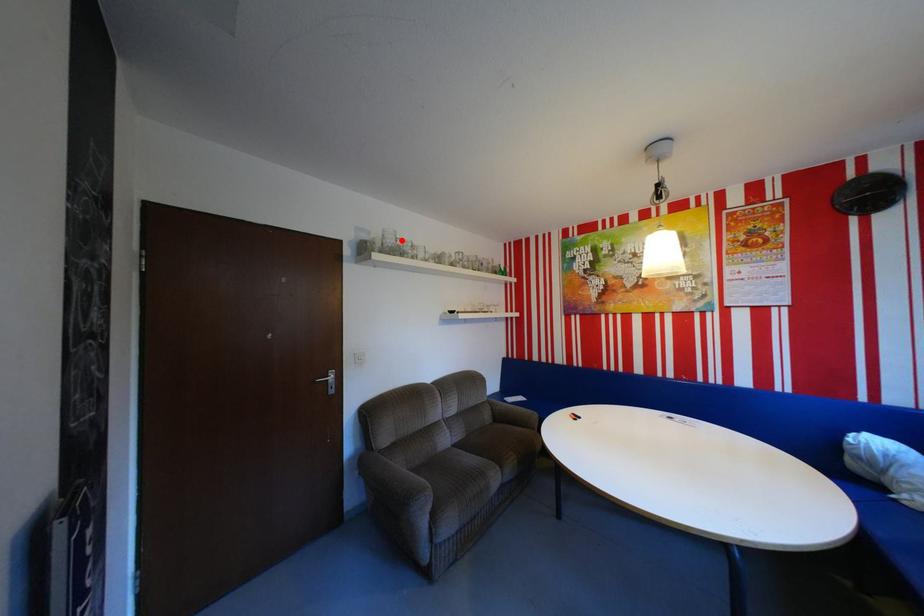
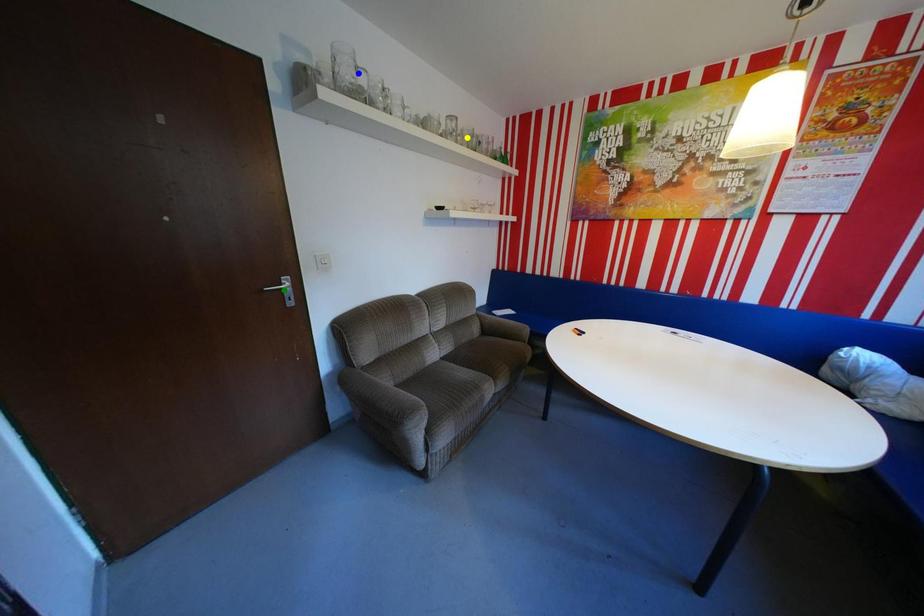
Question: I am providing you with two images of the same scene from different viewpoints. A red point is marked on the first image. You are given multiple points on the second image. Which spot in image 2 lines up with the point in image 1?

Choices:
 (A) yellow point
 (B) blue point
 (C) green point

Answer: (B)